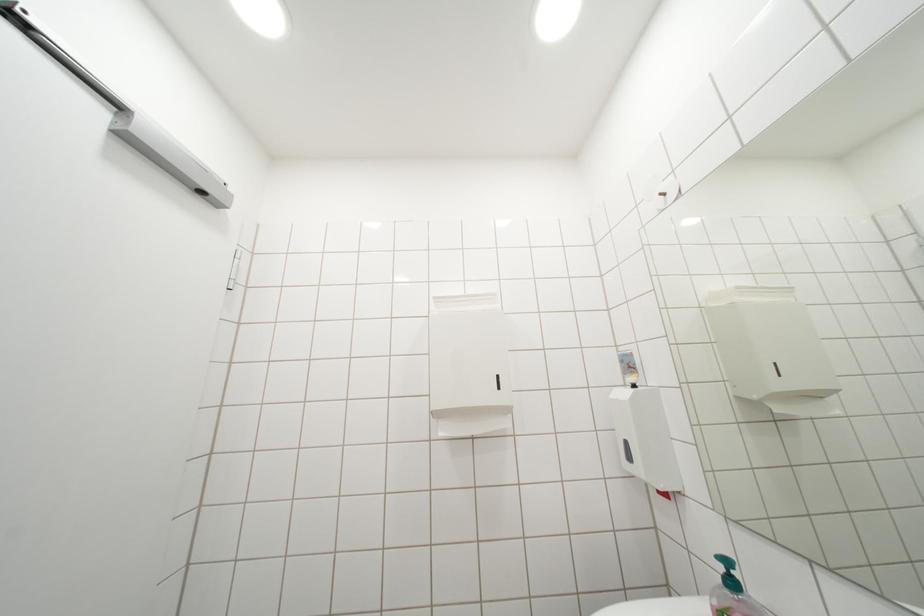
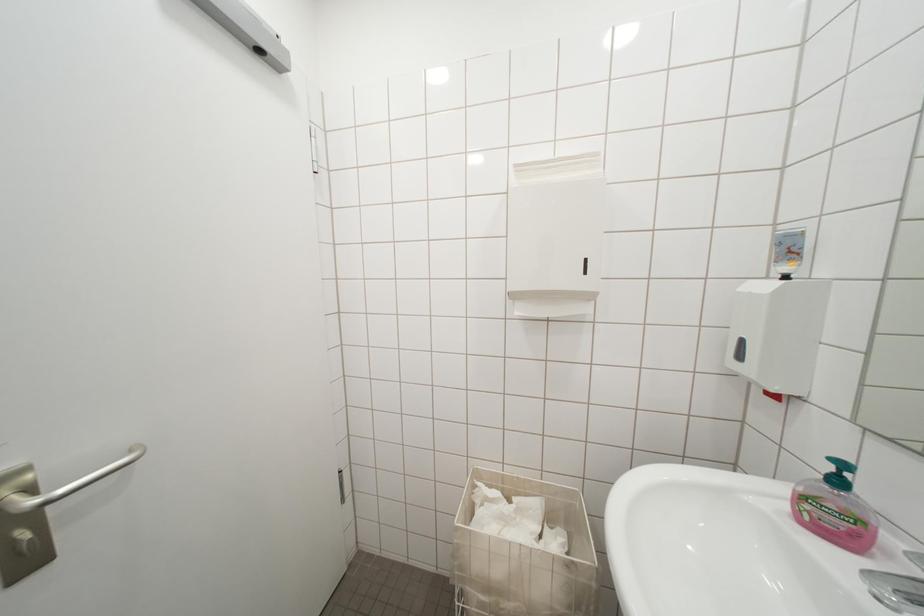
Based on the continuous images, in which direction is the camera rotating?

The rotation direction of the camera is left-down.